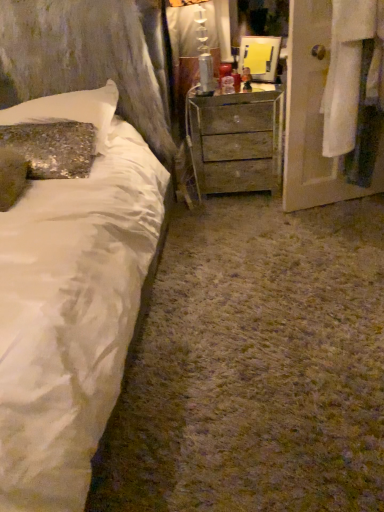
This screenshot has width=384, height=512. In order to click on free point in front of white fabric door at right in this screenshot , I will do point(339,244).